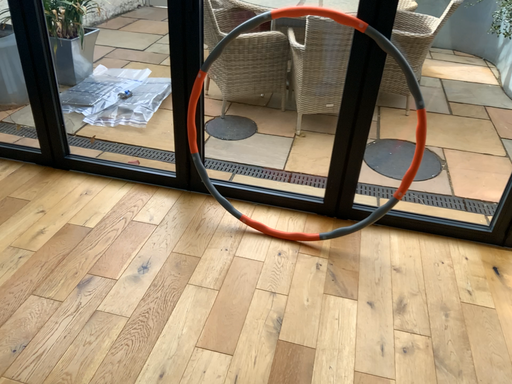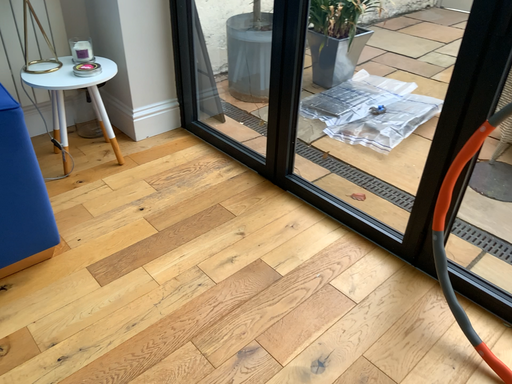
Question: How did the camera likely rotate when shooting the video?

Choices:
 (A) rotated right
 (B) rotated left

Answer: (B)